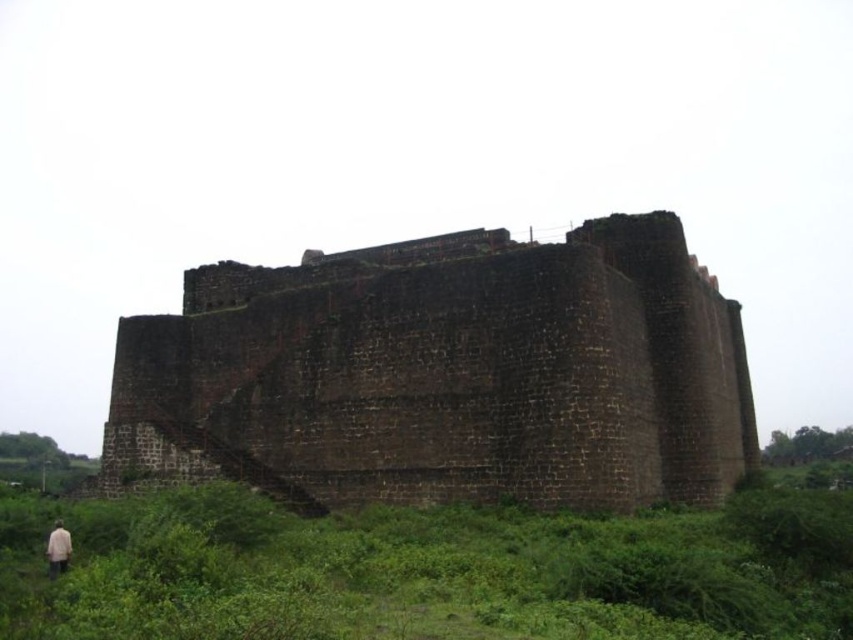
Question: Which is farther from the beige fabric person at lower left?

Choices:
 (A) brown stone castle at center
 (B) green leafy vegetation at lower left

Answer: (A)

Question: From the image, what is the correct spatial relationship of brown stone castle at center in relation to beige fabric person at lower left?

Choices:
 (A) left
 (B) right

Answer: (B)

Question: Among these objects, which one is nearest to the camera?

Choices:
 (A) green leafy vegetation at lower left
 (B) beige fabric person at lower left

Answer: (A)

Question: Which of the following is the closest to the observer?

Choices:
 (A) beige fabric person at lower left
 (B) brown stone castle at center

Answer: (A)

Question: Is green leafy vegetation at lower left in front of beige fabric person at lower left?

Choices:
 (A) no
 (B) yes

Answer: (B)

Question: From the image, what is the correct spatial relationship of brown stone castle at center in relation to beige fabric person at lower left?

Choices:
 (A) right
 (B) left

Answer: (A)